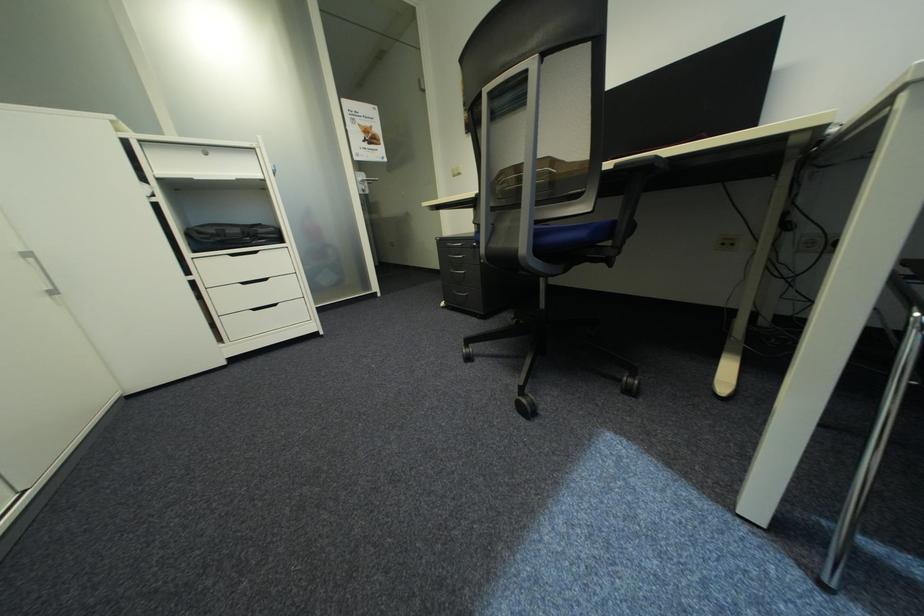
Image resolution: width=924 pixels, height=616 pixels. In order to click on blue chair sitting surface in this screenshot , I will do `click(584, 232)`.